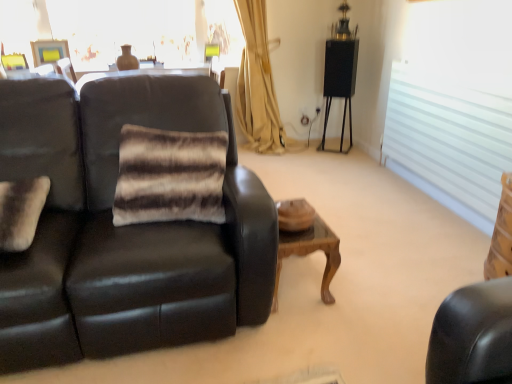
What are the coordinates of `vacant space to the right of woodenwoodentable at center` in the screenshot? It's located at (367, 276).